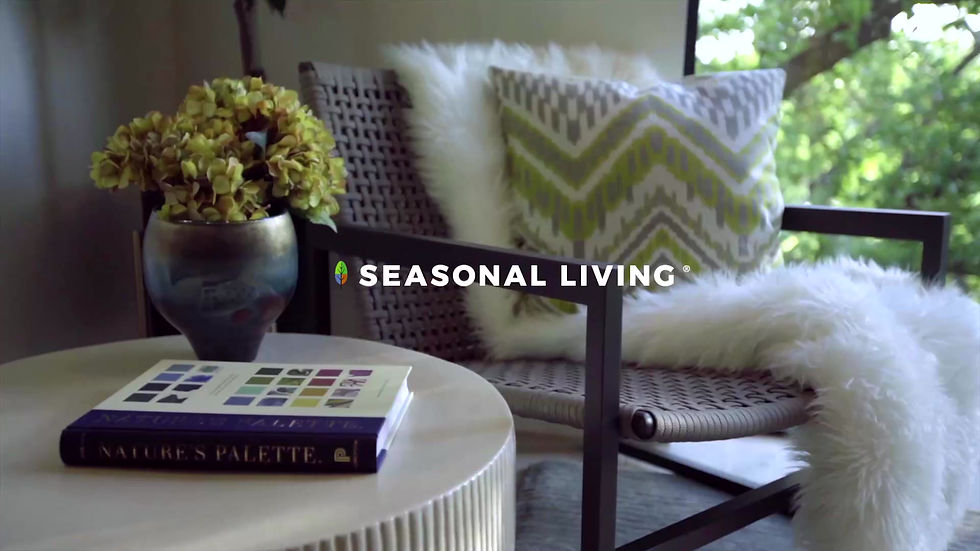
The image size is (980, 551). I want to click on plant holder, so (x=230, y=276).